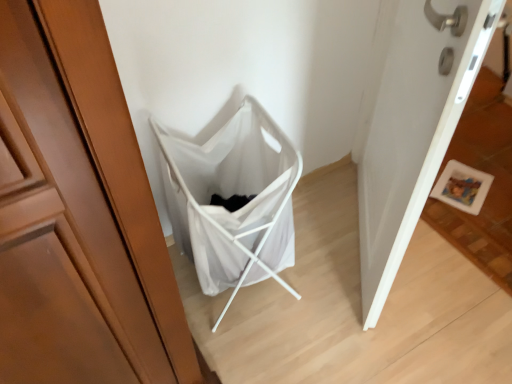
This screenshot has height=384, width=512. I want to click on vacant region in front of white fabric laundry basket at center, so click(x=263, y=354).